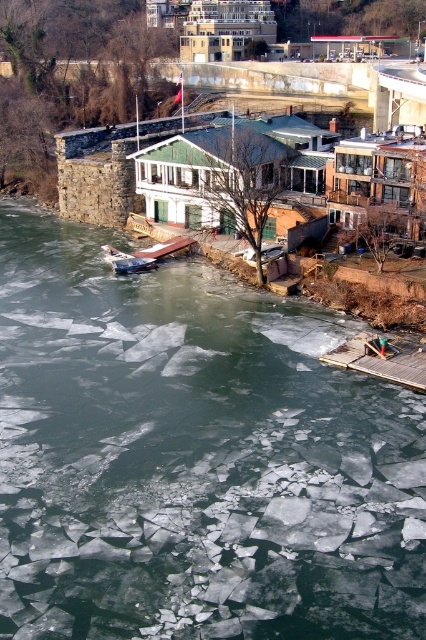
Question: Which object appears closest to the camera in this image?

Choices:
 (A) translucent ice at lower center
 (B) metallic silver boat at lower left

Answer: (A)

Question: Is translucent ice at lower center smaller than metallic silver boat at lower left?

Choices:
 (A) no
 (B) yes

Answer: (A)

Question: Which object appears farthest from the camera in this image?

Choices:
 (A) translucent ice at lower center
 (B) metallic silver boat at lower left

Answer: (B)

Question: Does translucent ice at lower center appear over metallic silver boat at lower left?

Choices:
 (A) yes
 (B) no

Answer: (B)

Question: Is translucent ice at lower center to the left of metallic silver boat at lower left from the viewer's perspective?

Choices:
 (A) no
 (B) yes

Answer: (A)

Question: Which object is farther from the camera taking this photo?

Choices:
 (A) metallic silver boat at lower left
 (B) translucent ice at lower center

Answer: (A)